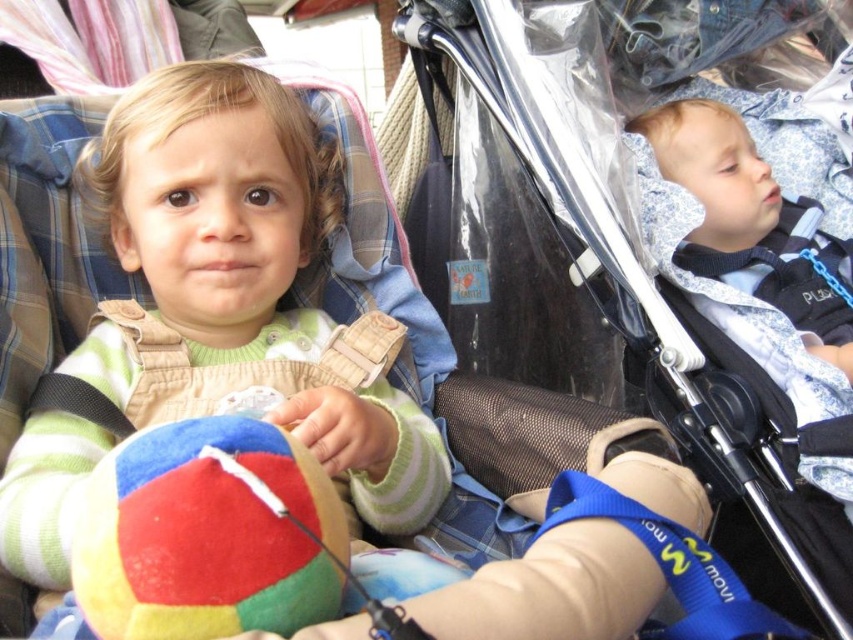
Which is more to the left, transparent plastic baby carriage at upper right or multicolored felt ball at center?

Positioned to the left is multicolored felt ball at center.

Can you confirm if transparent plastic baby carriage at upper right is shorter than multicolored felt ball at center?

No.

Find the location of a particular element. transparent plastic baby carriage at upper right is located at coordinates (692, 260).

Image resolution: width=853 pixels, height=640 pixels. What are the coordinates of `transparent plastic baby carriage at upper right` in the screenshot? It's located at (x=692, y=260).

Between soft fleece sweater at center and multicolored felt ball at center, which one has more height?

soft fleece sweater at center is taller.

How much distance is there between soft fleece sweater at center and multicolored felt ball at center?

soft fleece sweater at center is 15.91 inches away from multicolored felt ball at center.

The width and height of the screenshot is (853, 640). Describe the element at coordinates (242, 276) in the screenshot. I see `soft fleece sweater at center` at that location.

What are the coordinates of `soft fleece sweater at center` in the screenshot? It's located at (242, 276).

Is point (830, 179) positioned behind point (42, 570)?

That is True.

Is transparent plastic baby carriage at upper right to the left of soft fleece sweater at center from the viewer's perspective?

Incorrect, transparent plastic baby carriage at upper right is not on the left side of soft fleece sweater at center.

Does point (817, 500) come behind point (329, 412)?

Yes, it is behind point (329, 412).

At what (x,y) coordinates should I click in order to perform the action: click on transparent plastic baby carriage at upper right. Please return your answer as a coordinate pair (x, y). This screenshot has height=640, width=853. Looking at the image, I should click on (692, 260).